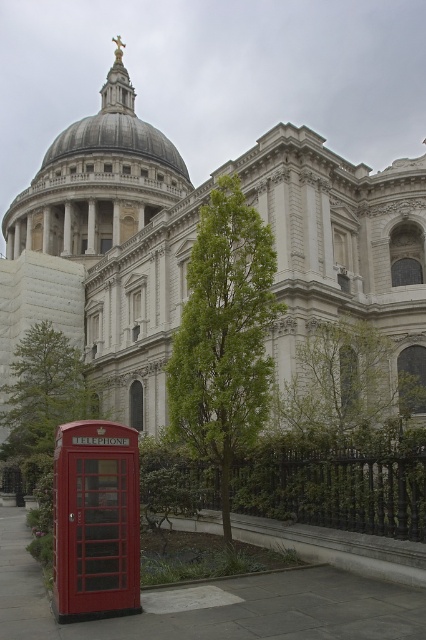
You are standing in front of St. Paul Cathedral and want to take a photo of the gray stone dome at center. If your camera can focus on objects up to 100 meters away, will you be able to capture the dome clearly?

The gray stone dome at center is 109.41 meters away from the viewer. Since the camera can only focus up to 100 meters, the dome is beyond the camera range, so it won not be captured clearly.